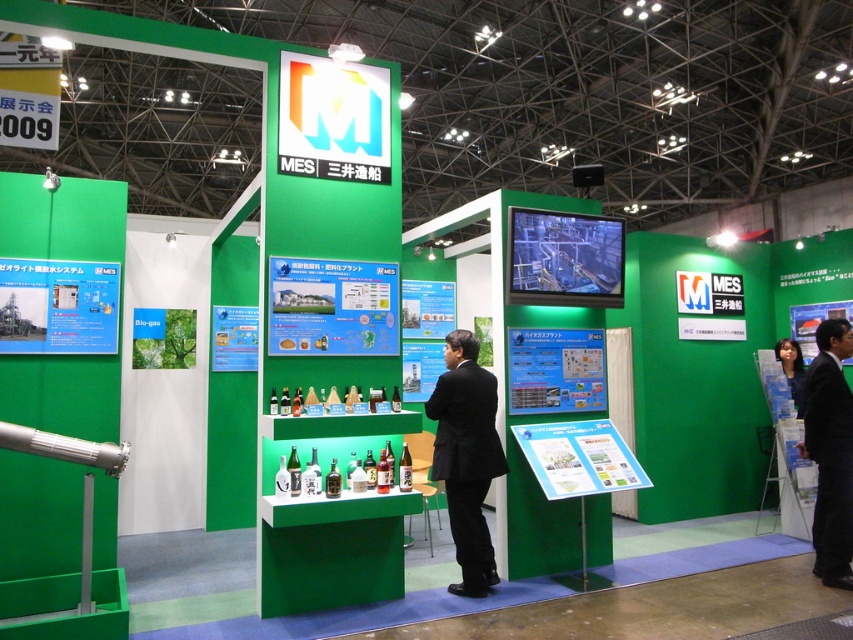
You are an event planner at the trade show and need to place a 1.2 meter wide banner between the black suit at center and the black suit at right. Is there enough space between them to fit the banner without overlapping either suit?

The black suit at center might be wider than black suit at right, so the total width required for both suits could exceed the available space. It is uncertain if the banner will fit without overlapping.

You are an attendee at the trade show and want to approach the MES booth. You are currently standing 10 feet away from the booth. If you walk straight towards the booth, which object will you encounter first between the black suit at right and the matte black hair at lower right?

The matte black hair at lower right will be encountered first because it is closer to the entrance of the booth compared to the black suit at right, which is positioned further back.

You are an attendee at the trade show and want to approach the MES booth. You see a black suit at center and a matte black hair at lower right. Which one is closer to you?

The black suit at center is closer to you because it has a larger size compared to the matte black hair at lower right.